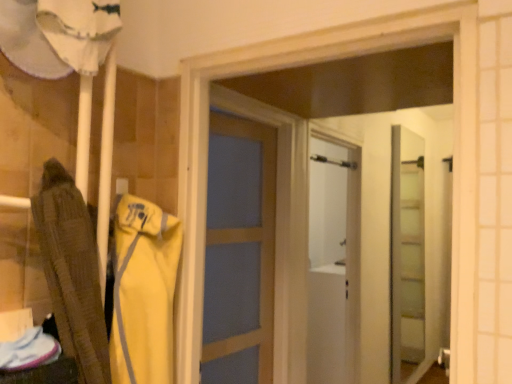
Question: Considering the relative positions of clear glass door at center and yellow fabric at left in the image provided, is clear glass door at center to the left or to the right of yellow fabric at left?

Choices:
 (A) left
 (B) right

Answer: (B)

Question: Looking at their shapes, would you say clear glass door at center is wider or thinner than yellow fabric at left?

Choices:
 (A) wide
 (B) thin

Answer: (B)

Question: Is point (417, 165) closer or farther from the camera than point (137, 240)?

Choices:
 (A) farther
 (B) closer

Answer: (A)

Question: Is point (131, 281) positioned closer to the camera than point (394, 226)?

Choices:
 (A) closer
 (B) farther

Answer: (A)

Question: From the image's perspective, relative to clear glass door at center, is yellow fabric at left above or below?

Choices:
 (A) above
 (B) below

Answer: (A)

Question: Considering the positions of yellow fabric at left and clear glass door at center in the image, is yellow fabric at left bigger or smaller than clear glass door at center?

Choices:
 (A) big
 (B) small

Answer: (B)

Question: From a real-world perspective, is yellow fabric at left physically located above or below clear glass door at center?

Choices:
 (A) below
 (B) above

Answer: (B)